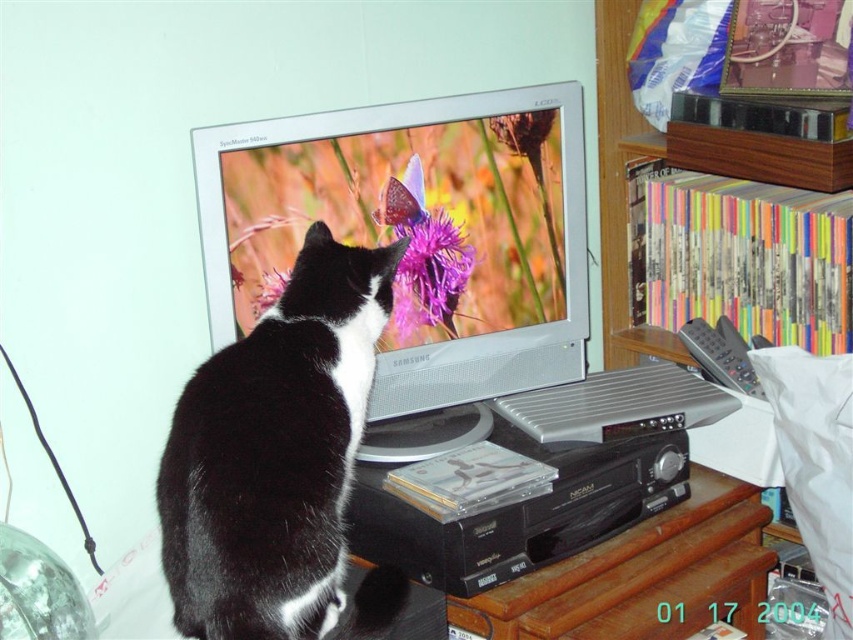
Question: Which point appears closest to the camera in this image?

Choices:
 (A) (204, 598)
 (B) (730, 376)

Answer: (A)

Question: Where is black and white fur cat at left located in relation to gray plastic remote at right in the image?

Choices:
 (A) right
 (B) left

Answer: (B)

Question: Is black and white fur cat at left thinner than gray plastic remote at right?

Choices:
 (A) yes
 (B) no

Answer: (B)

Question: Which object appears closest to the camera in this image?

Choices:
 (A) gray plastic remote at right
 (B) black and white fur cat at left

Answer: (B)

Question: Is black and white fur cat at left further to the viewer compared to gray plastic remote at right?

Choices:
 (A) no
 (B) yes

Answer: (A)